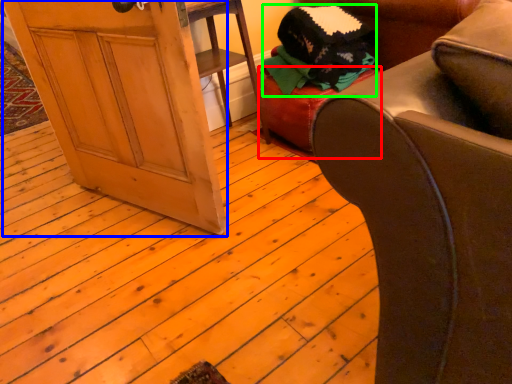
Question: Based on their relative distances, which object is nearer to stool (highlighted by a red box)? Choose from screen door (highlighted by a blue box) and clothing (highlighted by a green box).

Choices:
 (A) screen door
 (B) clothing

Answer: (B)